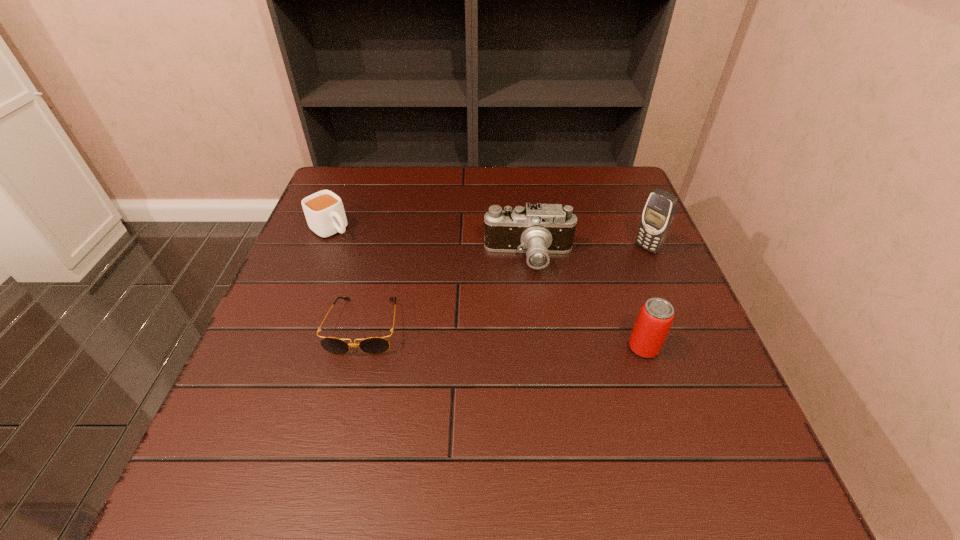
The height and width of the screenshot is (540, 960). I want to click on cup at the left edge, so click(324, 211).

Locate an element on the screen. This screenshot has height=540, width=960. beer can that is at the right edge is located at coordinates (655, 318).

I want to click on cellular telephone situated at the right edge, so click(659, 212).

What are the coordinates of `vacant region at the far edge of the desktop` in the screenshot? It's located at point(453,187).

Locate an element on the screen. free spot at the near edge of the desktop is located at coordinates (376, 416).

This screenshot has width=960, height=540. I want to click on vacant space at the left edge, so click(x=286, y=303).

In the image, there is a desktop. Where is `vacant space at the right edge`? The width and height of the screenshot is (960, 540). vacant space at the right edge is located at coordinates (659, 291).

Locate an element on the screen. The height and width of the screenshot is (540, 960). free space at the far left corner of the desktop is located at coordinates (366, 210).

Image resolution: width=960 pixels, height=540 pixels. In the image, there is a desktop. Find the location of `vacant space at the near left corner`. vacant space at the near left corner is located at coordinates (271, 415).

Locate an element on the screen. free space at the far right corner is located at coordinates (593, 187).